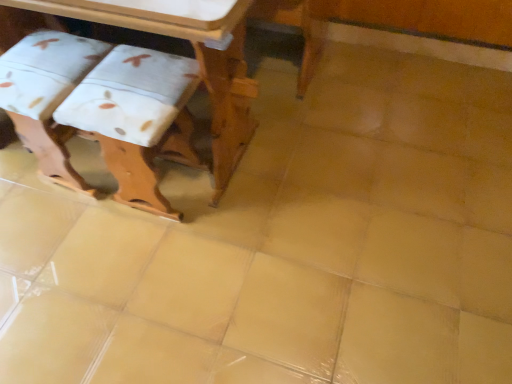
Measure the distance between white fabric step stool at left, arranged as the 1th step stool when viewed from the right, and camera.

white fabric step stool at left, arranged as the 1th step stool when viewed from the right, and camera are 1.12 meters apart from each other.

How much space does white fabric step stool at lower left, arranged as the 2th step stool when viewed from the right, occupy horizontally?

white fabric step stool at lower left, arranged as the 2th step stool when viewed from the right, is 14.07 inches in width.

Find the location of `white fabric step stool at left, arranged as the 1th step stool when viewed from the right`. white fabric step stool at left, arranged as the 1th step stool when viewed from the right is located at coordinates (137, 119).

Are white fabric step stool at left, which is counted as the second step stool, starting from the left, and wooden table at upper left far apart?

No, white fabric step stool at left, which is counted as the second step stool, starting from the left, is not far from wooden table at upper left.

From the image's perspective, is white fabric step stool at left, which is counted as the second step stool, starting from the left, positioned above or below wooden table at upper left?

white fabric step stool at left, which is counted as the second step stool, starting from the left, is situated lower than wooden table at upper left in the image.

Is white fabric step stool at left, arranged as the 1th step stool when viewed from the right, not inside wooden table at upper left?

No, most part of white fabric step stool at left, arranged as the 1th step stool when viewed from the right, lies within wooden table at upper left.

Can you tell me how much white fabric step stool at lower left, marked as the 1th step stool in a left-to-right arrangement, and white fabric step stool at left, arranged as the 1th step stool when viewed from the right, differ in facing direction?

The angular difference between white fabric step stool at lower left, marked as the 1th step stool in a left-to-right arrangement, and white fabric step stool at left, arranged as the 1th step stool when viewed from the right, is 1.78 degrees.

Considering the points (7, 91) and (108, 141), which point is behind, point (7, 91) or point (108, 141)?

The point (7, 91) is farther.

From a real-world perspective, is white fabric step stool at lower left, marked as the 1th step stool in a left-to-right arrangement, positioned above or below white fabric step stool at left, arranged as the 1th step stool when viewed from the right?

white fabric step stool at lower left, marked as the 1th step stool in a left-to-right arrangement, is situated lower than white fabric step stool at left, arranged as the 1th step stool when viewed from the right, in the real world.

From the picture: How many degrees apart are the facing directions of white fabric step stool at lower left, marked as the 1th step stool in a left-to-right arrangement, and wooden table at upper left?

The angle between the facing direction of white fabric step stool at lower left, marked as the 1th step stool in a left-to-right arrangement, and the facing direction of wooden table at upper left is 87.3 degrees.

Is the depth of white fabric step stool at lower left, marked as the 1th step stool in a left-to-right arrangement, less than that of wooden table at upper left?

No, white fabric step stool at lower left, marked as the 1th step stool in a left-to-right arrangement, is further to the viewer.

From the image's perspective, is white fabric step stool at lower left, arranged as the 2th step stool when viewed from the right, located above wooden table at upper left?

No, from the image's perspective, white fabric step stool at lower left, arranged as the 2th step stool when viewed from the right, is not above wooden table at upper left.

Between white fabric step stool at lower left, arranged as the 2th step stool when viewed from the right, and wooden table at upper left, which one has larger width?

wooden table at upper left.

Could you tell me if wooden table at upper left is turned towards white fabric step stool at lower left, arranged as the 2th step stool when viewed from the right?

No, wooden table at upper left is not turned towards white fabric step stool at lower left, arranged as the 2th step stool when viewed from the right.

From their relative heights in the image, would you say wooden table at upper left is taller or shorter than white fabric step stool at lower left, arranged as the 2th step stool when viewed from the right?

Clearly, wooden table at upper left is taller compared to white fabric step stool at lower left, arranged as the 2th step stool when viewed from the right.

Can you see wooden table at upper left touching white fabric step stool at lower left, arranged as the 2th step stool when viewed from the right?

wooden table at upper left and white fabric step stool at lower left, arranged as the 2th step stool when viewed from the right, are clearly separated.

Considering the relative sizes of wooden table at upper left and white fabric step stool at lower left, arranged as the 2th step stool when viewed from the right, in the image provided, is wooden table at upper left smaller than white fabric step stool at lower left, arranged as the 2th step stool when viewed from the right,?

No, wooden table at upper left is not smaller than white fabric step stool at lower left, arranged as the 2th step stool when viewed from the right.

Would you say wooden table at upper left is to the left or to the right of white fabric step stool at left, which is counted as the second step stool, starting from the left, in the picture?

From the image, it's evident that wooden table at upper left is to the left of white fabric step stool at left, which is counted as the second step stool, starting from the left.

Is wooden table at upper left thinner than white fabric step stool at left, arranged as the 1th step stool when viewed from the right?

Incorrect, the width of wooden table at upper left is not less than that of white fabric step stool at left, arranged as the 1th step stool when viewed from the right.

Considering the sizes of objects wooden table at upper left and white fabric step stool at left, arranged as the 1th step stool when viewed from the right, in the image provided, who is bigger, wooden table at upper left or white fabric step stool at left, arranged as the 1th step stool when viewed from the right,?

Bigger between the two is wooden table at upper left.

Can you confirm if wooden table at upper left is taller than white fabric step stool at left, arranged as the 1th step stool when viewed from the right?

Yes.

Which object is positioned more to the right, white fabric step stool at left, arranged as the 1th step stool when viewed from the right, or white fabric step stool at lower left, arranged as the 2th step stool when viewed from the right?

Positioned to the right is white fabric step stool at left, arranged as the 1th step stool when viewed from the right.

In the image, is white fabric step stool at left, which is counted as the second step stool, starting from the left, positioned in front of or behind white fabric step stool at lower left, arranged as the 2th step stool when viewed from the right?

In the image, white fabric step stool at left, which is counted as the second step stool, starting from the left, appears in front of white fabric step stool at lower left, arranged as the 2th step stool when viewed from the right.

Where is `step stool on the right of white fabric step stool at lower left, marked as the 1th step stool in a left-to-right arrangement`? Image resolution: width=512 pixels, height=384 pixels. step stool on the right of white fabric step stool at lower left, marked as the 1th step stool in a left-to-right arrangement is located at coordinates (137, 119).

Identify the location of the 2nd step stool below when counting from the wooden table at upper left (from the image's perspective). (137, 119).

The height and width of the screenshot is (384, 512). I want to click on step stool above the white fabric step stool at lower left, marked as the 1th step stool in a left-to-right arrangement (from a real-world perspective), so click(x=137, y=119).

Looking at the image, which one is located further to white fabric step stool at lower left, marked as the 1th step stool in a left-to-right arrangement, wooden table at upper left or white fabric step stool at left, which is counted as the second step stool, starting from the left?

The object further to white fabric step stool at lower left, marked as the 1th step stool in a left-to-right arrangement, is wooden table at upper left.

In the scene shown: Estimate the real-world distances between objects in this image. Which object is closer to white fabric step stool at left, arranged as the 1th step stool when viewed from the right, wooden table at upper left or white fabric step stool at lower left, marked as the 1th step stool in a left-to-right arrangement?

white fabric step stool at lower left, marked as the 1th step stool in a left-to-right arrangement, is positioned closer to the anchor white fabric step stool at left, arranged as the 1th step stool when viewed from the right.

When comparing their distances from white fabric step stool at lower left, marked as the 1th step stool in a left-to-right arrangement, does white fabric step stool at left, arranged as the 1th step stool when viewed from the right, or wooden table at upper left seem closer?

white fabric step stool at left, arranged as the 1th step stool when viewed from the right.

Which object lies nearer to the anchor point white fabric step stool at left, which is counted as the second step stool, starting from the left, white fabric step stool at lower left, marked as the 1th step stool in a left-to-right arrangement, or wooden table at upper left?

Among the two, white fabric step stool at lower left, marked as the 1th step stool in a left-to-right arrangement, is located nearer to white fabric step stool at left, which is counted as the second step stool, starting from the left.

Which object lies further to the anchor point wooden table at upper left, white fabric step stool at lower left, marked as the 1th step stool in a left-to-right arrangement, or white fabric step stool at left, arranged as the 1th step stool when viewed from the right?

Among the two, white fabric step stool at lower left, marked as the 1th step stool in a left-to-right arrangement, is located further to wooden table at upper left.

Based on their spatial positions, is white fabric step stool at left, arranged as the 1th step stool when viewed from the right, or white fabric step stool at lower left, arranged as the 2th step stool when viewed from the right, further from wooden table at upper left?

white fabric step stool at lower left, arranged as the 2th step stool when viewed from the right, is positioned further to the anchor wooden table at upper left.

Locate an element on the screen. step stool located between wooden table at upper left and white fabric step stool at lower left, arranged as the 2th step stool when viewed from the right, in the depth direction is located at coordinates (137, 119).